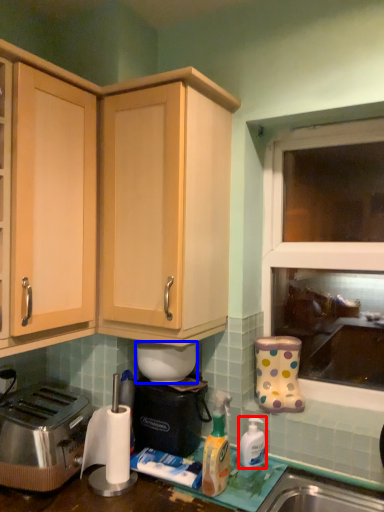
Question: Which object is further to the camera taking this photo, bottle (highlighted by a red box) or appliance (highlighted by a blue box)?

Choices:
 (A) bottle
 (B) appliance

Answer: (B)